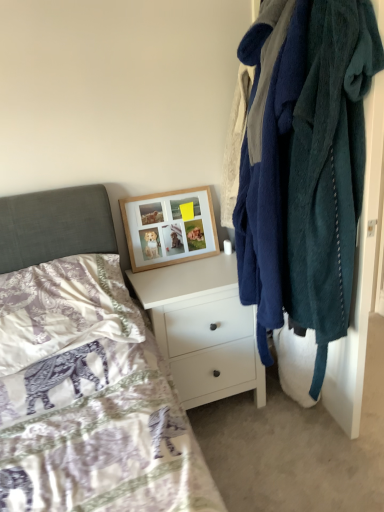
Locate an element on the screen. The image size is (384, 512). vacant space situated above white matte chest of drawers at center (from a real-world perspective) is located at coordinates (185, 270).